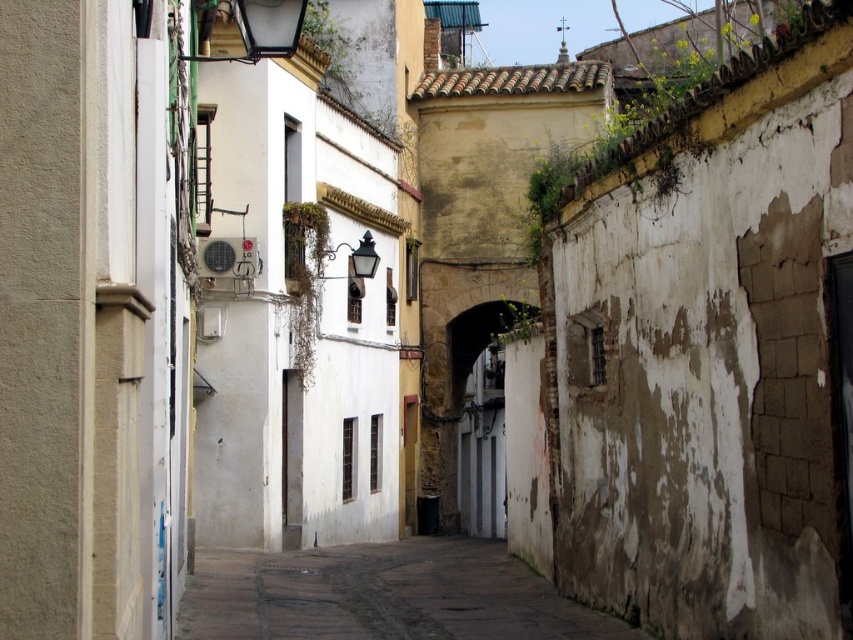
Question: Is smooth stone alley at center thinner than white stone archway at center?

Choices:
 (A) no
 (B) yes

Answer: (A)

Question: Is smooth stone alley at center further to the viewer compared to white stone archway at center?

Choices:
 (A) yes
 (B) no

Answer: (B)

Question: Which of the following is the farthest from the observer?

Choices:
 (A) smooth stone alley at center
 (B) white stone archway at center

Answer: (B)

Question: Among these points, which one is farthest from the camera?

Choices:
 (A) (318, 576)
 (B) (462, 381)

Answer: (B)

Question: Does smooth stone alley at center appear under white stone archway at center?

Choices:
 (A) no
 (B) yes

Answer: (B)